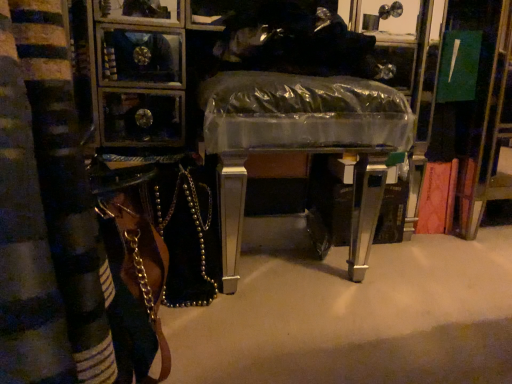
Where is `vacant space underneath clear plastic table at center (from a real-world perspective)`? vacant space underneath clear plastic table at center (from a real-world perspective) is located at coordinates (292, 267).